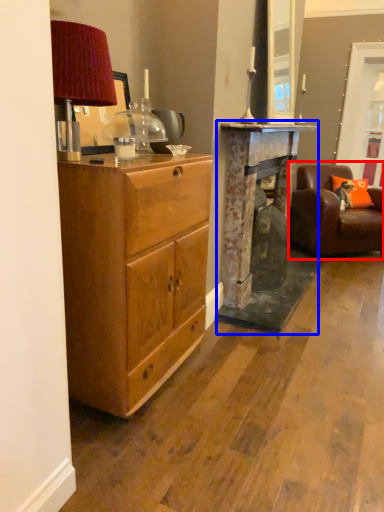
Question: Among these objects, which one is nearest to the camera, chair (highlighted by a red box) or fireplace (highlighted by a blue box)?

Choices:
 (A) chair
 (B) fireplace

Answer: (B)